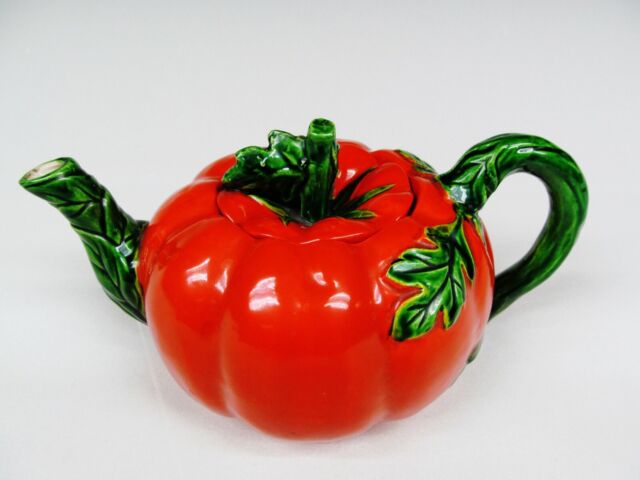
At what (x,y) coordinates should I click in order to perform the action: click on tea pot spout interior. Please return your answer as a coordinate pair (x, y). This screenshot has width=640, height=480. Looking at the image, I should click on pyautogui.click(x=43, y=172).